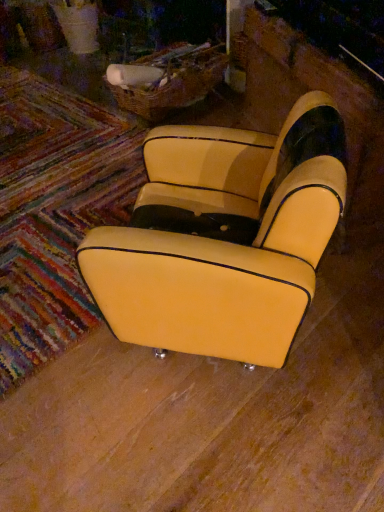
Where is `free space above yellow leather mat at lower left (from a real-world perspective)`? The image size is (384, 512). free space above yellow leather mat at lower left (from a real-world perspective) is located at coordinates 57,150.